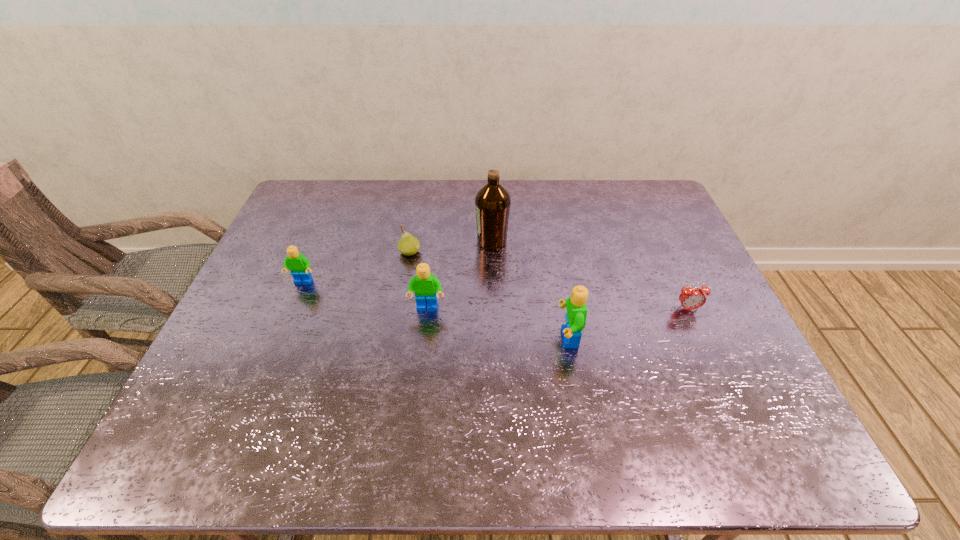
The image size is (960, 540). What are the coordinates of `vacant space located 0.050m on the face of the fourth tallest object` in the screenshot? It's located at (296, 300).

The width and height of the screenshot is (960, 540). I want to click on free space located 0.110m on the face of the second nearest Lego, so click(422, 349).

I want to click on vacant region located on the face of the rightmost Lego, so click(528, 338).

Where is `vacant area located 0.280m on the face of the rightmost Lego`? This screenshot has width=960, height=540. vacant area located 0.280m on the face of the rightmost Lego is located at coordinates (443, 338).

Where is `vacant space situated 0.180m on the face of the rightmost Lego`? The width and height of the screenshot is (960, 540). vacant space situated 0.180m on the face of the rightmost Lego is located at coordinates (484, 338).

Find the location of a particular element. The width and height of the screenshot is (960, 540). vacant space located 0.240m on the label of the olive oil is located at coordinates (397, 241).

I want to click on vacant space situated 0.310m on the label of the olive oil, so click(374, 241).

This screenshot has height=540, width=960. I want to click on free space located on the label of the olive oil, so click(355, 241).

Identify the location of free space located on the face of the rightmost object. (701, 338).

What are the coordinates of `vacant space located 0.250m on the back of the pear` in the screenshot? It's located at (420, 199).